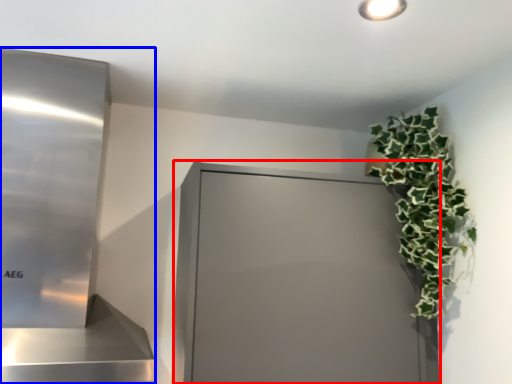
Question: Among these objects, which one is farthest to the camera, glass door (highlighted by a red box) or appliance (highlighted by a blue box)?

Choices:
 (A) glass door
 (B) appliance

Answer: (A)